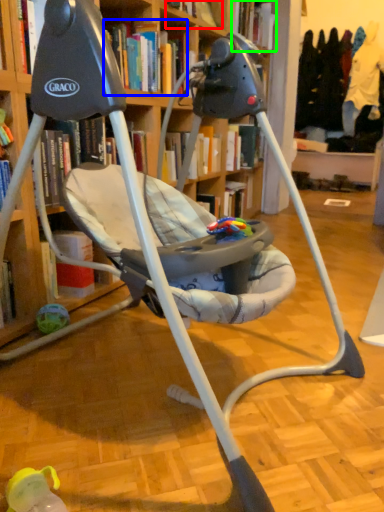
Question: Which object is the closest to the book (highlighted by a red box)? Choose among these: book (highlighted by a blue box) or book (highlighted by a green box).

Choices:
 (A) book
 (B) book

Answer: (A)